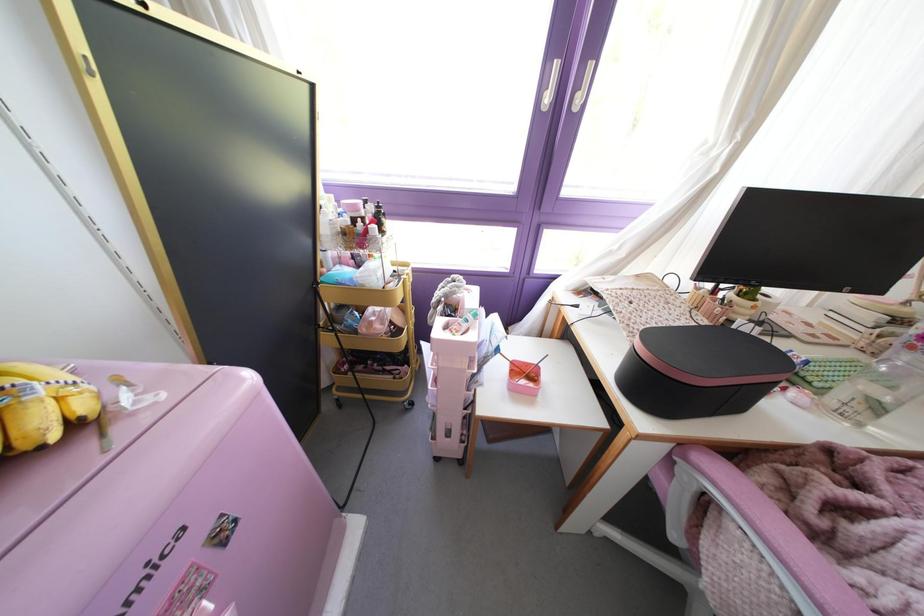
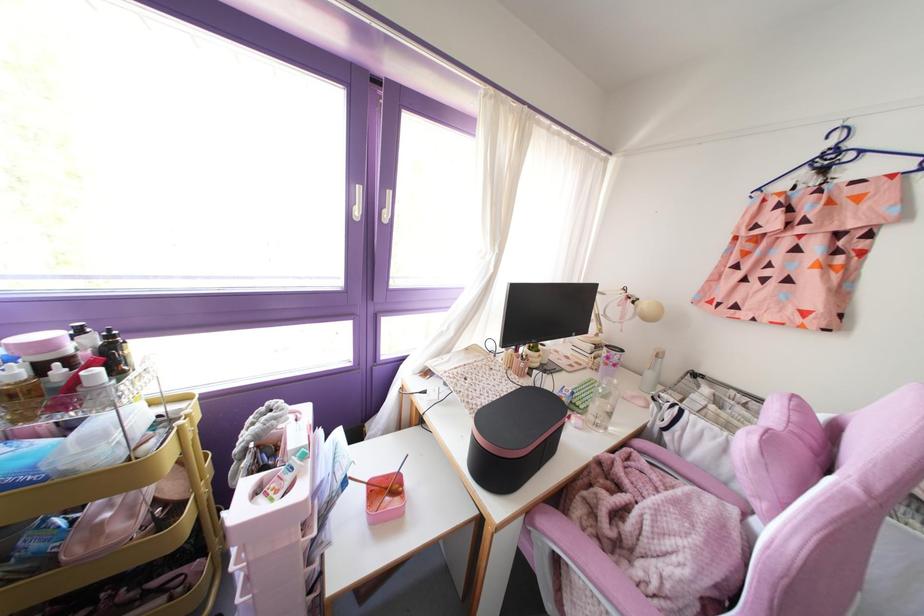
Where in the second image is the point corresponding to (x=381, y=231) from the first image?

(116, 373)